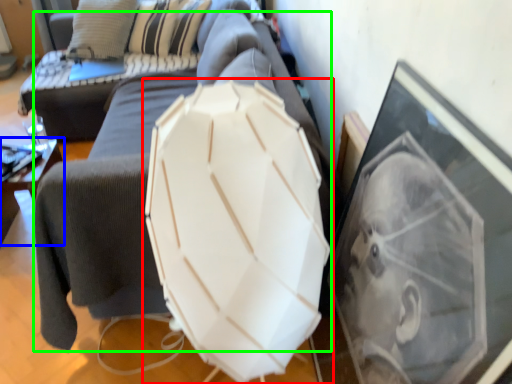
Question: Considering the real-world distances, which object is farthest from umbrella (highlighted by a red box)? furniture (highlighted by a blue box) or swivel chair (highlighted by a green box)?

Choices:
 (A) furniture
 (B) swivel chair

Answer: (A)